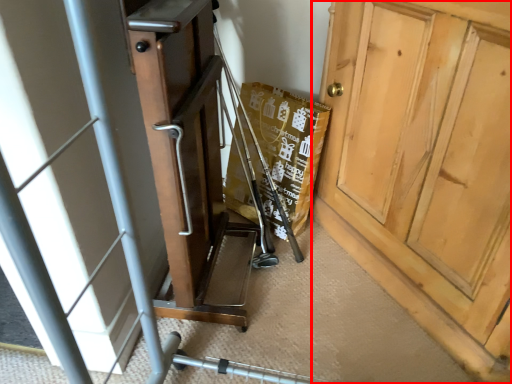
Question: From the image's perspective, what is the correct spatial relationship of door (annotated by the red box) in relation to baby carriage?

Choices:
 (A) above
 (B) below

Answer: (A)